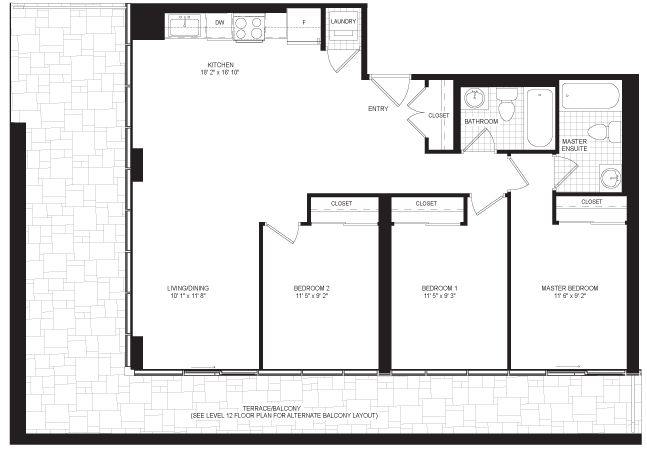
The height and width of the screenshot is (458, 647). I want to click on bedrooms, so click(x=345, y=301), click(x=448, y=321), click(x=578, y=325).